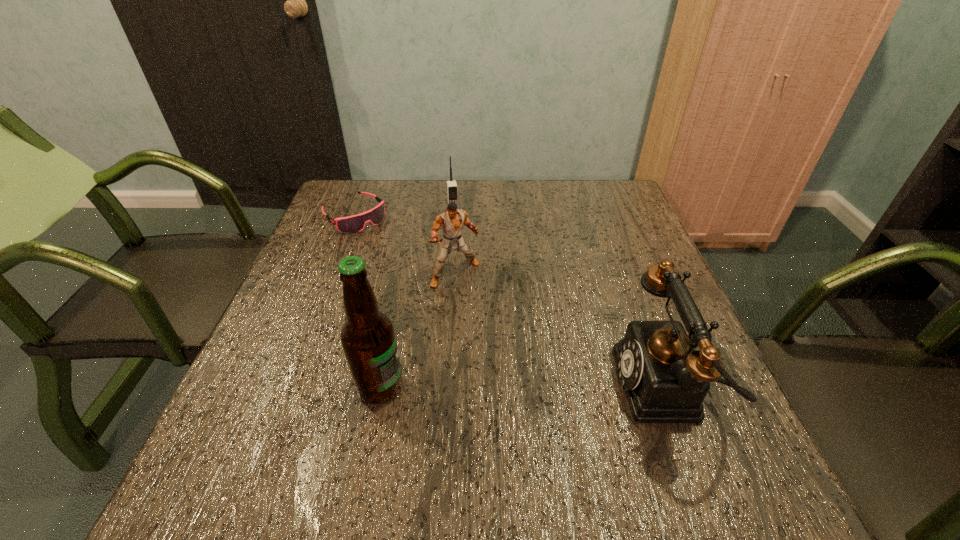
Identify the location of the fourth object from right to left. This screenshot has height=540, width=960. (368, 339).

Image resolution: width=960 pixels, height=540 pixels. I want to click on beer bottle, so click(368, 339).

Where is `telephone`? telephone is located at coordinates (665, 380).

Where is `the third nearest object`? The height and width of the screenshot is (540, 960). the third nearest object is located at coordinates (451, 221).

Locate an element on the screen. The width and height of the screenshot is (960, 540). the leftmost object is located at coordinates (352, 224).

This screenshot has width=960, height=540. I want to click on the shortest object, so click(x=352, y=224).

The height and width of the screenshot is (540, 960). I want to click on cellular telephone, so click(452, 190).

I want to click on free space located 0.120m on the label of the second object from left to right, so click(x=468, y=387).

Find the location of a particular element. Image resolution: width=960 pixels, height=540 pixels. free region located on the front of the rightmost object at the rotary dial is located at coordinates (590, 387).

Find the location of a particular element. Image resolution: width=960 pixels, height=540 pixels. vacant position located 0.210m on the front of the rightmost object at the rotary dial is located at coordinates (506, 387).